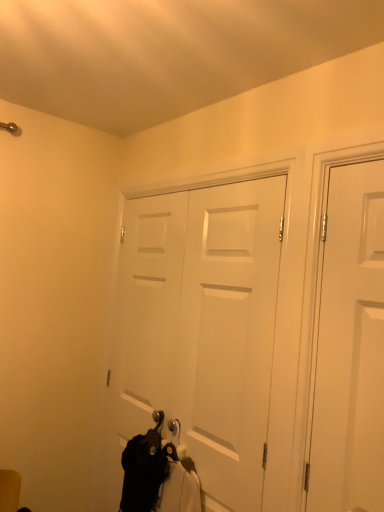
Question: Considering the relative sizes of white matte door at center, acting as the 2th door starting from the right, and black fabric at lower center in the image provided, is white matte door at center, acting as the 2th door starting from the right, smaller than black fabric at lower center?

Choices:
 (A) no
 (B) yes

Answer: (A)

Question: Does white matte door at center, marked as the first door in a back-to-front arrangement, turn towards black fabric at lower center?

Choices:
 (A) no
 (B) yes

Answer: (B)

Question: From the image's perspective, is white matte door at center, the 2th door from the front, below black fabric at lower center?

Choices:
 (A) no
 (B) yes

Answer: (A)

Question: Does white matte door at center, acting as the 2th door starting from the right, touch black fabric at lower center?

Choices:
 (A) yes
 (B) no

Answer: (B)

Question: Is white matte door at center, the 2th door from the front, not close to black fabric at lower center?

Choices:
 (A) no
 (B) yes

Answer: (A)

Question: Based on their positions, is white matte door at center, acting as the 2th door starting from the right, located to the left or right of white matte door at right, placed as the first door when sorted from front to back?

Choices:
 (A) left
 (B) right

Answer: (A)

Question: From the image's perspective, is white matte door at center, which is the 1th door in left-to-right order, above or below white matte door at right, placed as the first door when sorted from front to back?

Choices:
 (A) above
 (B) below

Answer: (B)

Question: From their relative heights in the image, would you say white matte door at center, marked as the first door in a back-to-front arrangement, is taller or shorter than white matte door at right, the second door when ordered from left to right?

Choices:
 (A) short
 (B) tall

Answer: (B)

Question: Looking at their shapes, would you say white matte door at center, the 2th door from the front, is wider or thinner than white matte door at right, placed as the first door when sorted from front to back?

Choices:
 (A) wide
 (B) thin

Answer: (B)

Question: From the image's perspective, is white matte door at right, placed as the first door when sorted from front to back, positioned above or below white matte door at center, the 2th door from the front?

Choices:
 (A) below
 (B) above

Answer: (B)

Question: Choose the correct answer: Is white matte door at right, the 2th door from the back, inside white matte door at center, which is the 1th door in left-to-right order, or outside it?

Choices:
 (A) inside
 (B) outside

Answer: (B)

Question: Considering the positions of white matte door at right, the second door when ordered from left to right, and white matte door at center, acting as the 2th door starting from the right, in the image, is white matte door at right, the second door when ordered from left to right, wider or thinner than white matte door at center, acting as the 2th door starting from the right,?

Choices:
 (A) wide
 (B) thin

Answer: (A)

Question: Considering their positions, is white matte door at right, the second door when ordered from left to right, located in front of or behind white matte door at center, acting as the 2th door starting from the right?

Choices:
 (A) behind
 (B) front

Answer: (B)

Question: In the image, is black fabric at lower center on the left side or the right side of white matte door at center, marked as the first door in a back-to-front arrangement?

Choices:
 (A) left
 (B) right

Answer: (A)

Question: Is black fabric at lower center situated inside white matte door at center, the 2th door from the front, or outside?

Choices:
 (A) outside
 (B) inside

Answer: (A)